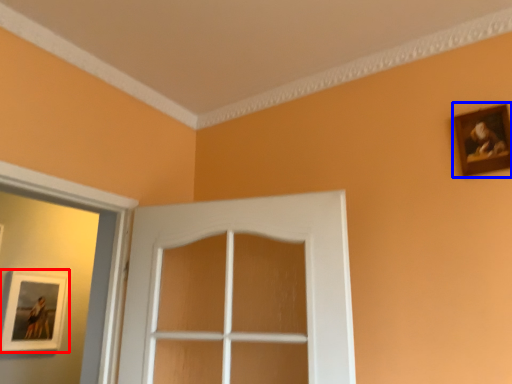
Question: Which point is closer to the camera, picture frame (highlighted by a red box) or picture frame (highlighted by a blue box)?

Choices:
 (A) picture frame
 (B) picture frame

Answer: (B)